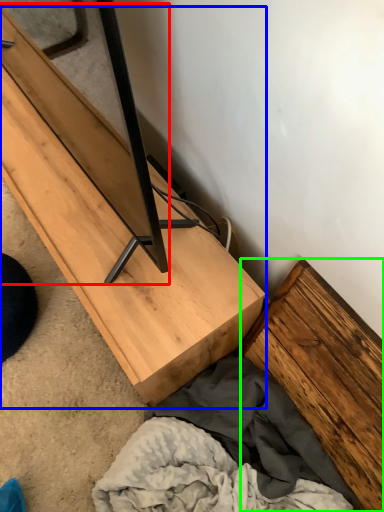
Question: Which object is the closest to the plank (highlighted by a red box)? Choose among these: furniture (highlighted by a blue box) or plank (highlighted by a green box).

Choices:
 (A) furniture
 (B) plank

Answer: (A)